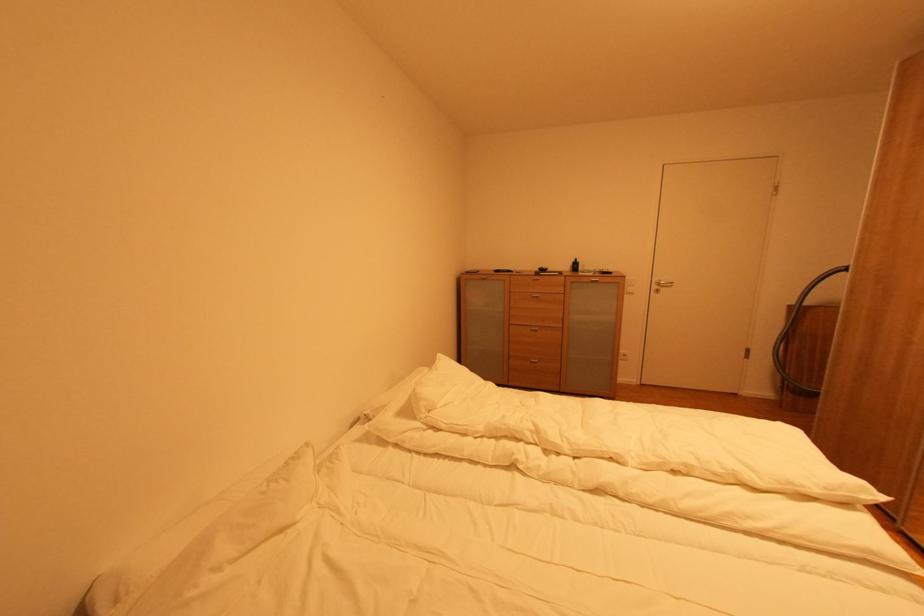
The width and height of the screenshot is (924, 616). Describe the element at coordinates (661, 285) in the screenshot. I see `the silver door handle` at that location.